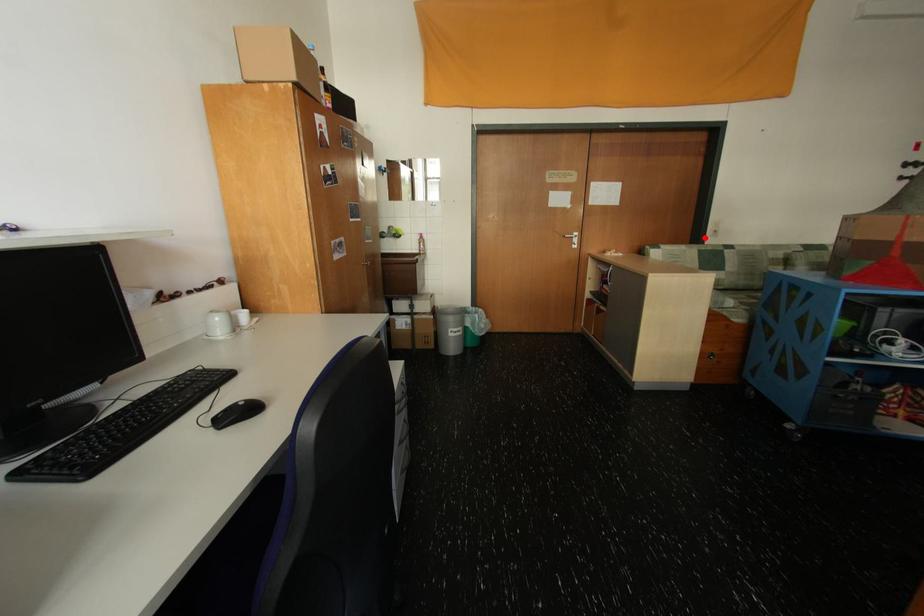
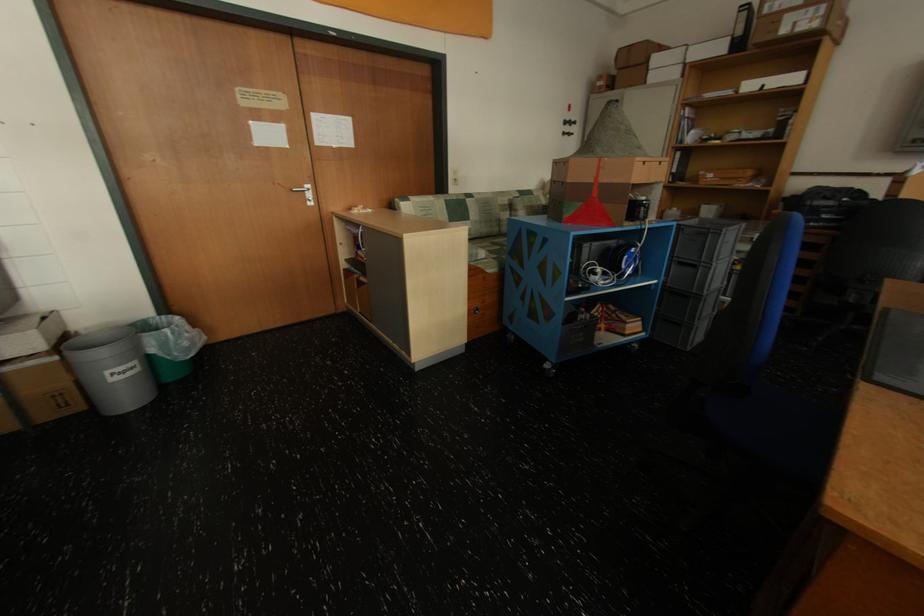
Question: I am providing you with two images of the same scene from different viewpoints. In image1, a red point is highlighted. Considering the same 3D point in image2, which of the following is correct?

Choices:
 (A) It is closer
 (B) It is farther

Answer: (A)